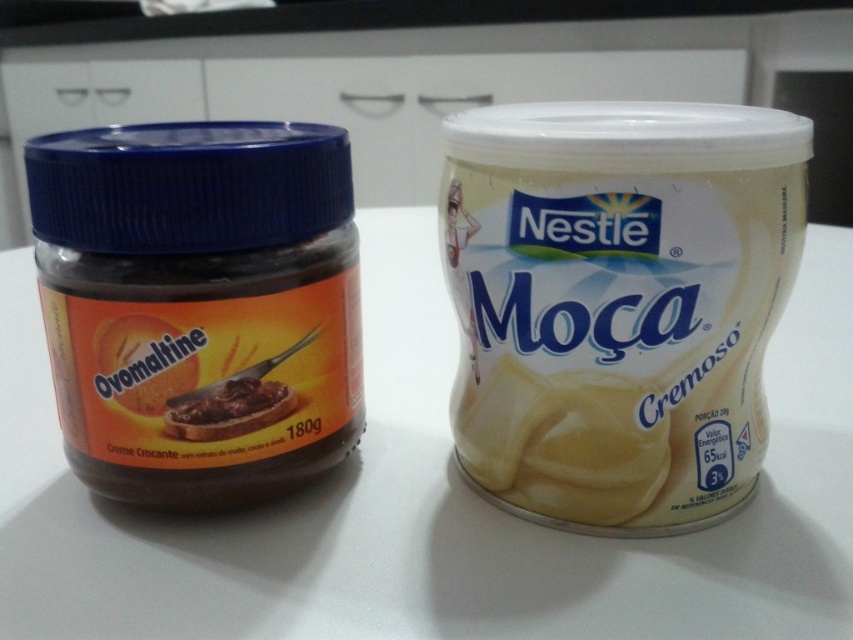
You are organizing a picnic and have both the white creamy tub at center and the dark brown creamy spread at left. Which container should you choose if you want to carry more of the product?

The white creamy tub at center has a larger size compared to the dark brown creamy spread at left, so it can hold more product and is better for carrying more.

From the picture: You are a chef preparing a dessert and need to reach both the white creamy tub at center and the dark brown creamy spread at left. Which one is closer to you?

The white creamy tub at center is closer to you because it is in front of the dark brown creamy spread at left.

You are a chef preparing a dessert and need to place both the white creamy tub at center and the dark brown creamy spread at left on a shelf. The shelf has limited vertical space. Which product should you place lower to save vertical space?

The dark brown creamy spread at left should be placed lower because the white creamy tub at center is above it, meaning the white creamy tub takes up more vertical space above. Placing the dark brown creamy spread lower would allow the white creamy tub to be stacked above it without exceeding the shelf height limit.